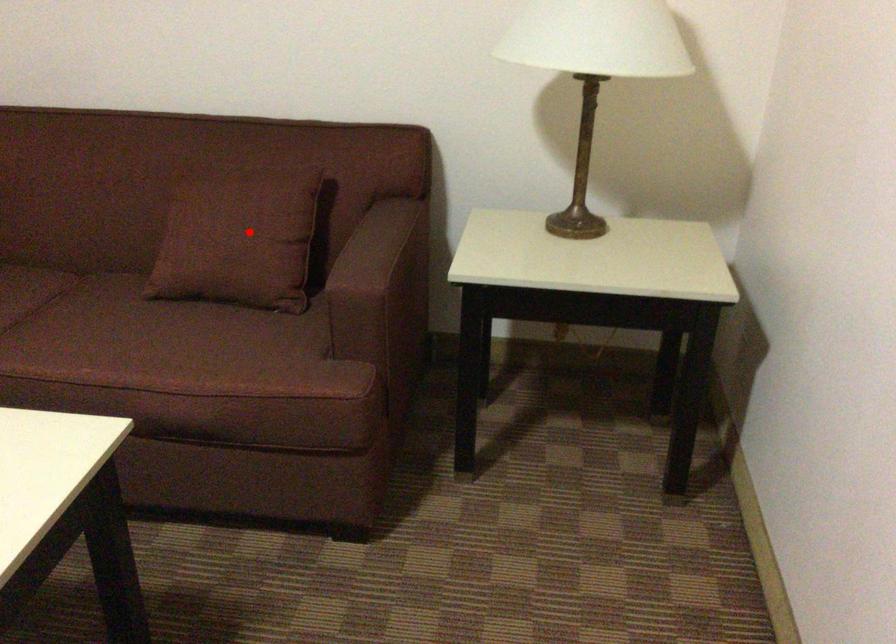
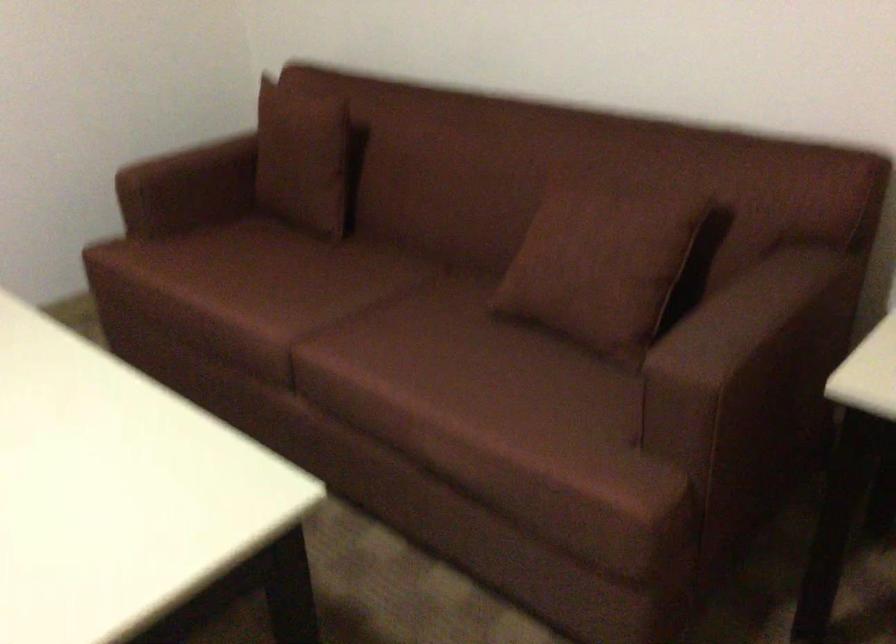
Question: I am providing you with two images of the same scene from different viewpoints. In image1, a red point is highlighted. Considering the same 3D point in image2, which of the following is correct?

Choices:
 (A) It is closer
 (B) It is farther

Answer: (A)